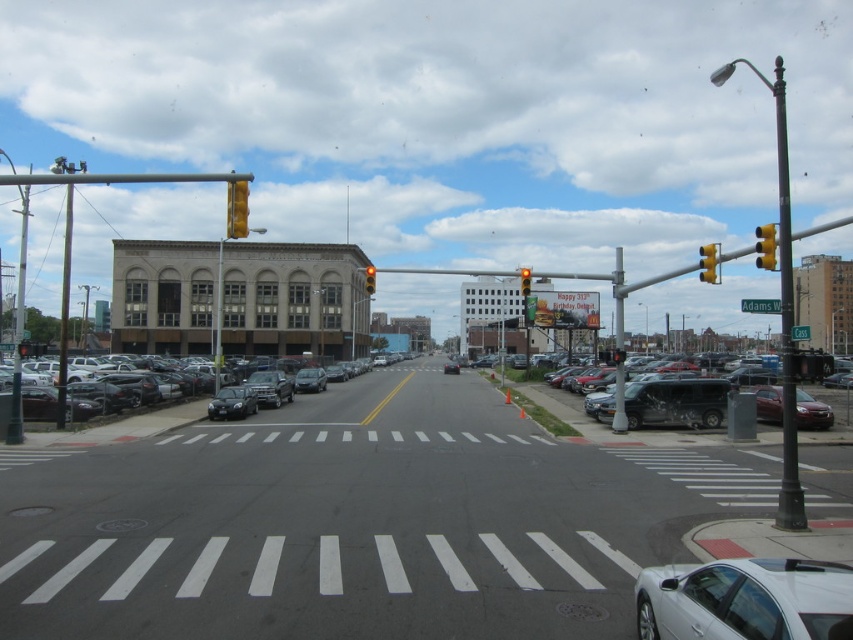
Can you confirm if matte black van at right is positioned above red glass traffic light at upper center?

Actually, matte black van at right is below red glass traffic light at upper center.

Does matte black van at right have a lesser height compared to red glass traffic light at upper center?

Correct, matte black van at right is not as tall as red glass traffic light at upper center.

Find the location of `matte black van at right`. matte black van at right is located at coordinates (834, 404).

From the picture: Is white glossy sedan at lower right to the right of metallic pole at right from the viewer's perspective?

In fact, white glossy sedan at lower right is to the left of metallic pole at right.

How distant is white glossy sedan at lower right from metallic pole at right?

white glossy sedan at lower right is 44.43 meters away from metallic pole at right.

Between point (717, 600) and point (782, 291), which one is positioned behind?

The point (782, 291) is behind.

I want to click on white glossy sedan at lower right, so click(x=741, y=600).

Who is higher up, yellow plastic traffic light at upper right or yellow plastic traffic light at upper center?

yellow plastic traffic light at upper right is higher up.

Where is `yellow plastic traffic light at upper right`? This screenshot has width=853, height=640. yellow plastic traffic light at upper right is located at coordinates (709, 262).